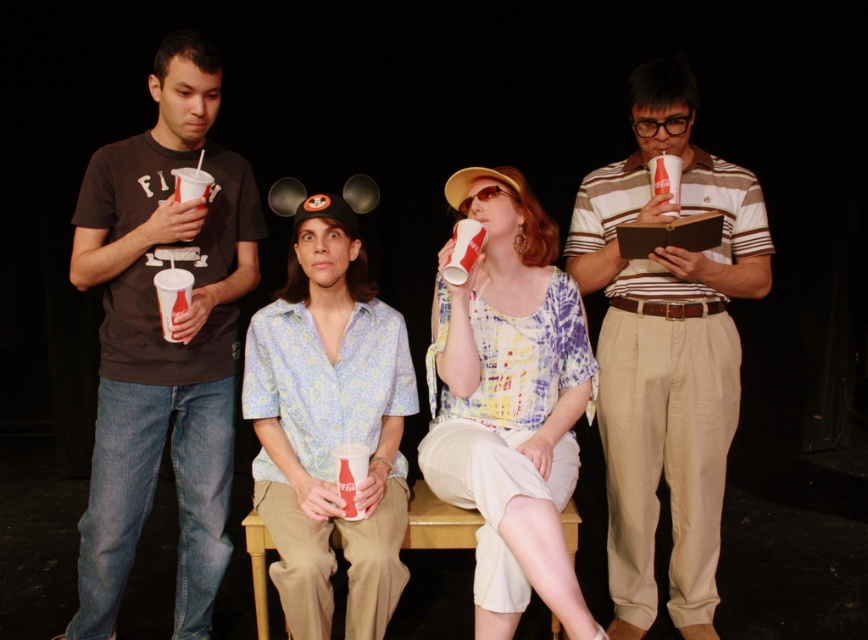
Is striped cotton shirt at center thinner than white paper cup at left?

No, striped cotton shirt at center is not thinner than white paper cup at left.

Is striped cotton shirt at center to the right of white paper cup at left from the viewer's perspective?

Yes, striped cotton shirt at center is to the right of white paper cup at left.

Between point (696, 372) and point (156, 291), which one is positioned in front?

Point (156, 291) is more forward.

Identify the location of striped cotton shirt at center. (667, 349).

Is point (244, 259) in front of point (445, 460)?

No, (244, 259) is behind (445, 460).

Does matte black t-shirt at left have a greater width compared to matte paper cup at center?

Indeed, matte black t-shirt at left has a greater width compared to matte paper cup at center.

Which is in front, point (109, 436) or point (501, 508)?

Point (501, 508) is more forward.

The height and width of the screenshot is (640, 868). I want to click on matte black t-shirt at left, so click(163, 339).

Does matte black t-shirt at left have a greater height compared to striped cotton shirt at center?

Yes, matte black t-shirt at left is taller than striped cotton shirt at center.

Who is taller, matte black t-shirt at left or striped cotton shirt at center?

With more height is matte black t-shirt at left.

Does point (191, 541) lie behind point (766, 220)?

Yes, it is.

Locate an element on the screen. The height and width of the screenshot is (640, 868). matte black t-shirt at left is located at coordinates (163, 339).